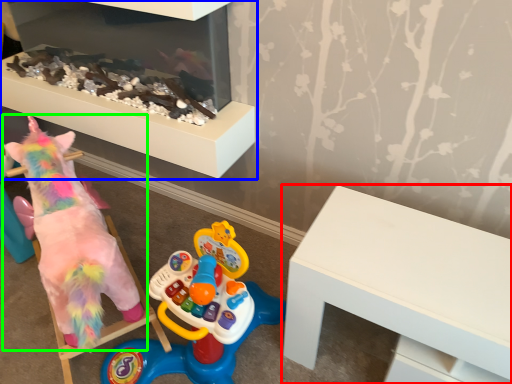
Question: Estimate the real-world distances between objects in this image. Which object is closer to table (highlighted by a red box), furniture (highlighted by a blue box) or toy (highlighted by a green box)?

Choices:
 (A) furniture
 (B) toy

Answer: (B)